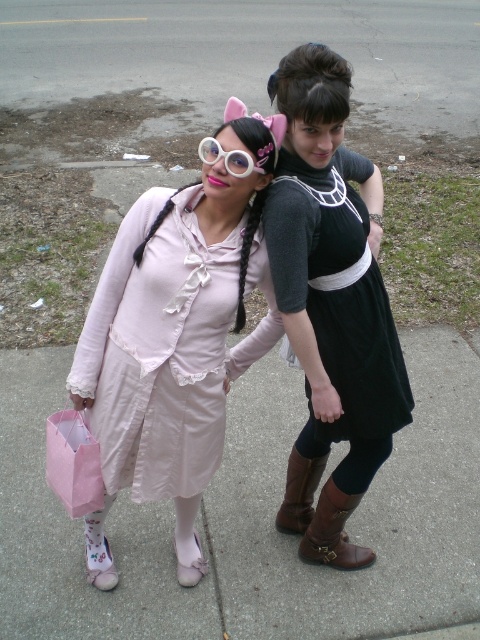
You are a photographer trying to capture both the matte pink dress at center and the light pink fabric dress at left in a single shot. Since you want to ensure both are visible, which dress should you focus on first to maintain clarity in the photo?

You should focus on the matte pink dress at center first because it is in front of the light pink fabric dress at left, so focusing on the front object will keep both in better clarity.

You are standing at the origin point of the coordinate system in this scene. You want to walk to the smooth concrete pavement at center. What are the coordinates you need to move towards?

The coordinates you need to move towards are 0.812 in the x direction and 0.525 in the y direction.